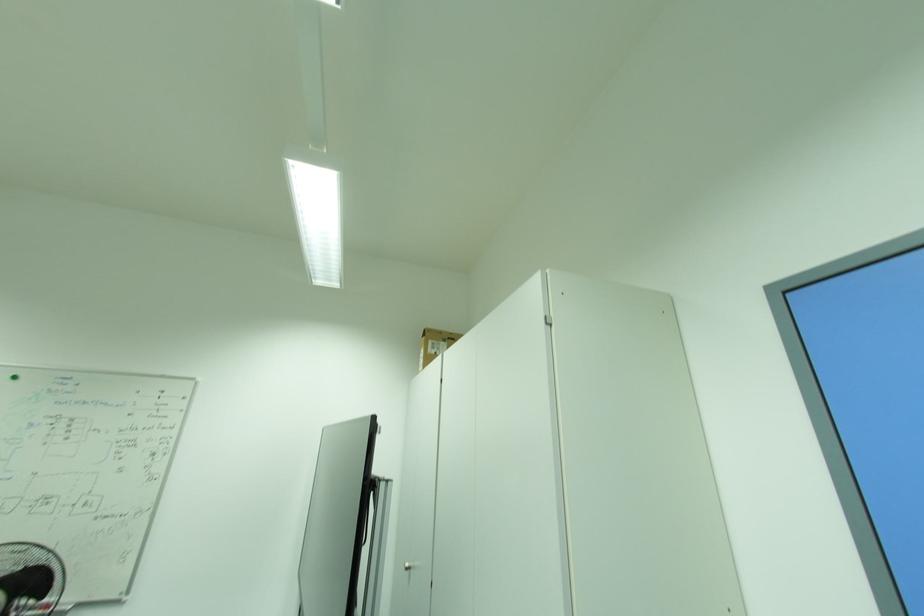
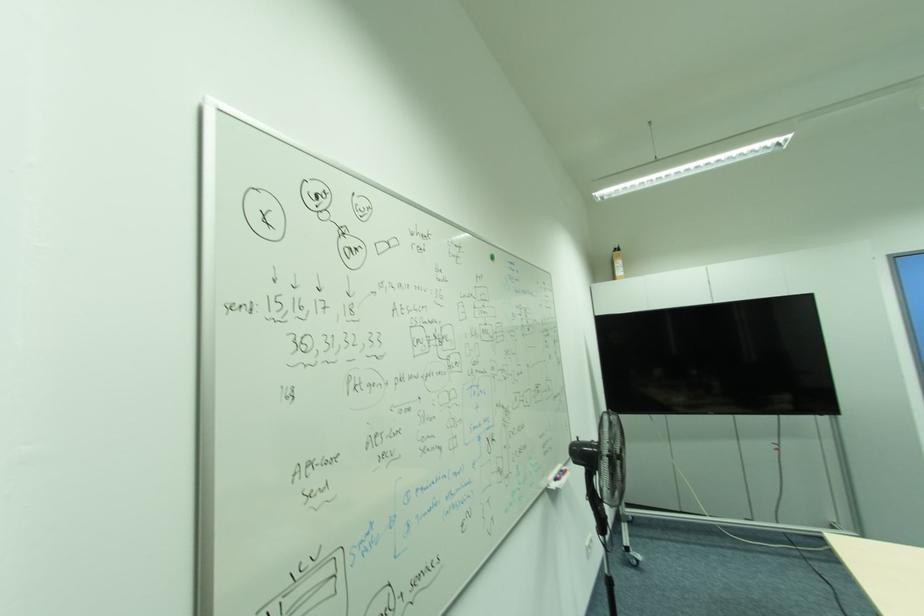
Question: I am providing you with two images of the same scene from different viewpoints. Which of the following objects are not visible in image2?

Choices:
 (A) red whiteboard marker
 (B) bottle pump top
 (C) silver cabinet handle
 (D) dark textured pillow

Answer: (C)